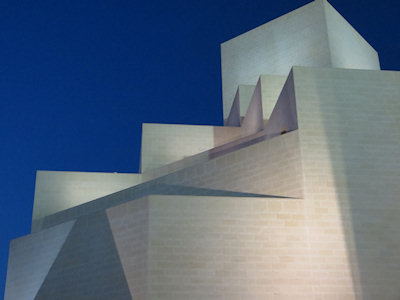
The width and height of the screenshot is (400, 300). I want to click on right edge of square ledge, so click(x=311, y=65), click(x=273, y=73), click(x=250, y=85), click(x=186, y=126), click(x=91, y=171), click(x=208, y=195).